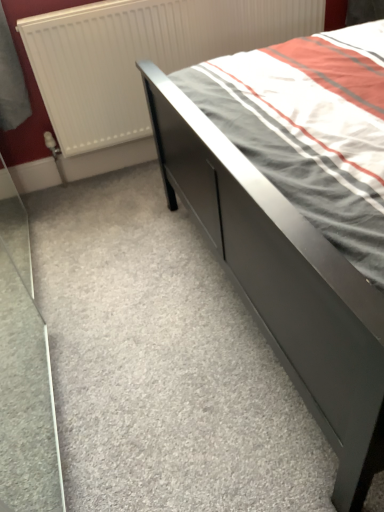
Question: Can you confirm if matte gray bed at center is smaller than white matte radiator at upper left?

Choices:
 (A) no
 (B) yes

Answer: (A)

Question: Can you confirm if matte gray bed at center is thinner than white matte radiator at upper left?

Choices:
 (A) yes
 (B) no

Answer: (B)

Question: Does matte gray bed at center lie in front of white matte radiator at upper left?

Choices:
 (A) yes
 (B) no

Answer: (A)

Question: Could you tell me if matte gray bed at center is turned towards white matte radiator at upper left?

Choices:
 (A) yes
 (B) no

Answer: (B)

Question: Is matte gray bed at center located outside white matte radiator at upper left?

Choices:
 (A) yes
 (B) no

Answer: (A)

Question: Does matte gray bed at center contain white matte radiator at upper left?

Choices:
 (A) no
 (B) yes

Answer: (A)

Question: From a real-world perspective, is white matte radiator at upper left physically above matte gray bed at center?

Choices:
 (A) no
 (B) yes

Answer: (B)

Question: From the image's perspective, does white matte radiator at upper left appear lower than matte gray bed at center?

Choices:
 (A) no
 (B) yes

Answer: (A)

Question: Does white matte radiator at upper left have a larger size compared to matte gray bed at center?

Choices:
 (A) no
 (B) yes

Answer: (A)

Question: Is matte gray bed at center at the back of white matte radiator at upper left?

Choices:
 (A) yes
 (B) no

Answer: (B)

Question: Does white matte radiator at upper left have a greater height compared to matte gray bed at center?

Choices:
 (A) no
 (B) yes

Answer: (B)

Question: Does white matte radiator at upper left have a greater width compared to matte gray bed at center?

Choices:
 (A) no
 (B) yes

Answer: (A)

Question: In terms of width, does white matte radiator at upper left look wider or thinner when compared to matte gray bed at center?

Choices:
 (A) wide
 (B) thin

Answer: (B)